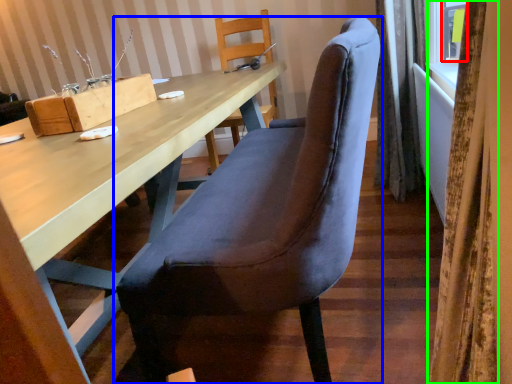
Question: Considering the real-world distances, which object is closest to window (highlighted by a red box)? chair (highlighted by a blue box) or curtain (highlighted by a green box).

Choices:
 (A) chair
 (B) curtain

Answer: (A)